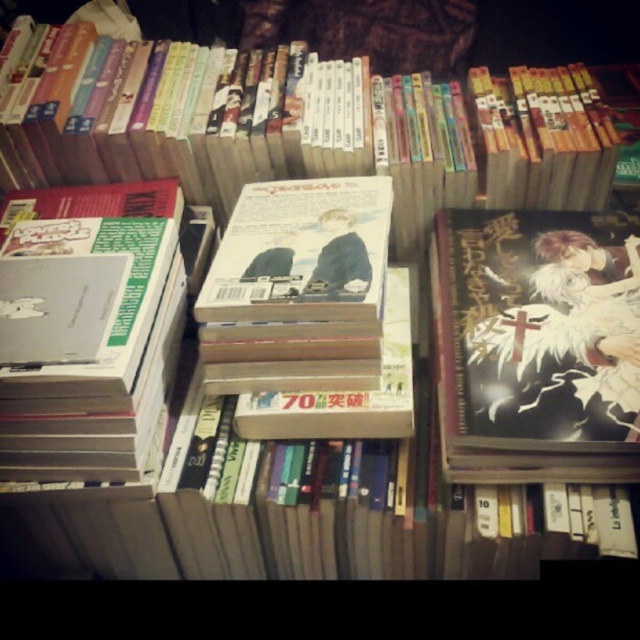
Is black matte manga at center positioned behind matte paperback book at center?

No, it is not.

The width and height of the screenshot is (640, 640). Describe the element at coordinates (536, 344) in the screenshot. I see `black matte manga at center` at that location.

This screenshot has height=640, width=640. Identify the location of black matte manga at center. (536, 344).